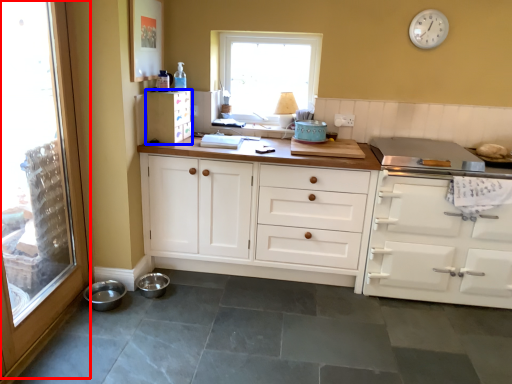
Question: Which point is closer to the camera, glass door (highlighted by a red box) or cabinetry (highlighted by a blue box)?

Choices:
 (A) glass door
 (B) cabinetry

Answer: (A)